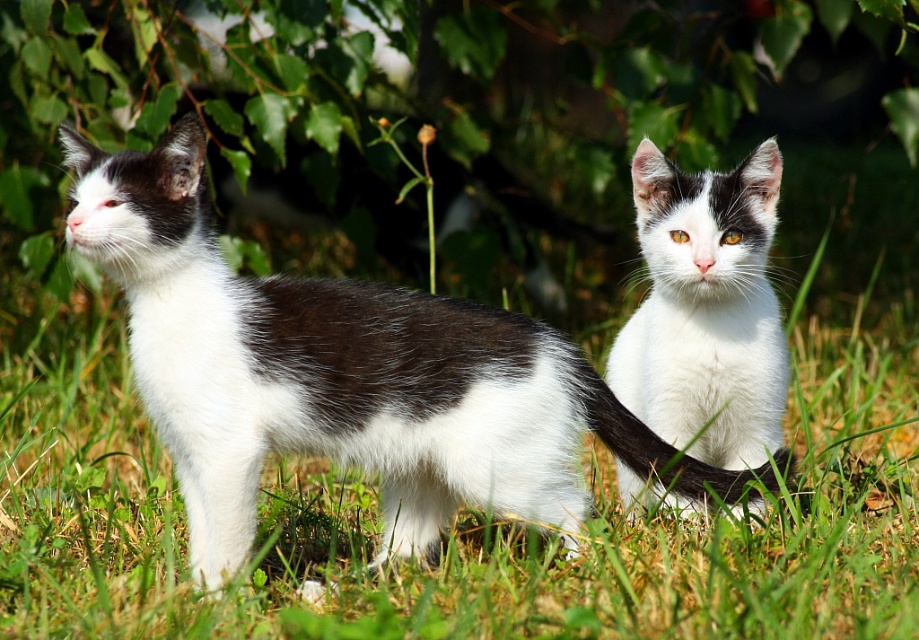
Consider the image. You are a photographer trying to capture both cats in a single shot. Since the background is slightly out of focus, which cat should you adjust your focus on to ensure the black and white fur cat at left and the white soft fur cat at center are both in focus?

You should focus on the black and white fur cat at left because it is in front of the white soft fur cat at center, so focusing on the closer subject will keep both in focus due to the depth of field.

You are a photographer trying to capture both the black and white fur cat at left and the black fur tail at center in a single frame. Which cat should you position closer to the left side of the camera frame to include both subjects without cropping?

You should position the black and white fur cat at left closer to the left side of the camera frame since it is already to the left of the black fur tail at center, ensuring both are included without cropping.

You are a photographer trying to capture a photo of the black and white fur cat at left and the white soft fur cat at center. From your current position, which cat appears closer to the ground?

The black and white fur cat at left appears closer to the ground because it is positioned below the white soft fur cat at center.